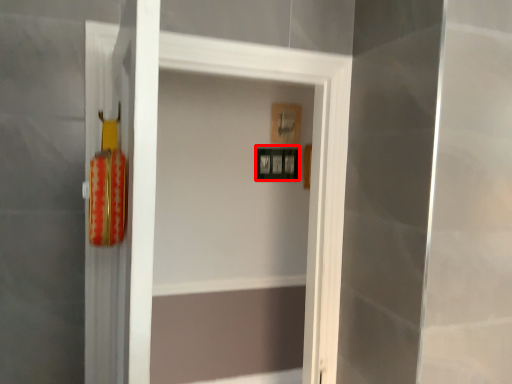
Question: From the image's perspective, what is the correct spatial positioning of picture frame (annotated by the red box) in reference to picture frame?

Choices:
 (A) below
 (B) above

Answer: (A)